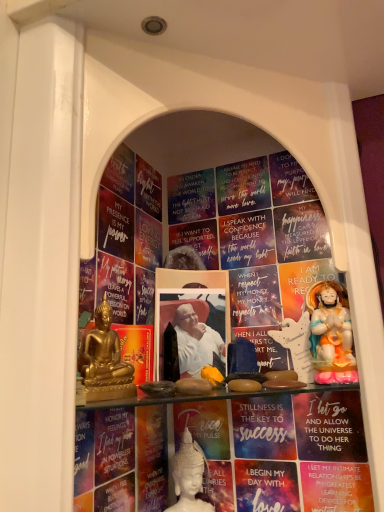
Question: Can you confirm if matte blue paperback book at center, the first paperback book in the right-to-left sequence, is wider than white porcelain statue at center, the 2th person from the left?

Choices:
 (A) no
 (B) yes

Answer: (A)

Question: From a real-world perspective, does matte blue paperback book at center, the first paperback book in the right-to-left sequence, sit lower than white porcelain statue at center, placed as the 2th person when sorted from right to left?

Choices:
 (A) yes
 (B) no

Answer: (B)

Question: Would you say matte blue paperback book at center, the 3th paperback book from the left, contains white porcelain statue at center, the 3th person from the top?

Choices:
 (A) yes
 (B) no

Answer: (B)

Question: From the image's perspective, is matte blue paperback book at center, the first paperback book in the right-to-left sequence, beneath white porcelain statue at center, the 3th person positioned from the front?

Choices:
 (A) yes
 (B) no

Answer: (B)

Question: From a real-world perspective, is matte blue paperback book at center, the 3th paperback book from the left, physically above white porcelain statue at center, the 3th person positioned from the front?

Choices:
 (A) yes
 (B) no

Answer: (A)

Question: Is matte blue paperback book at center, the 3th paperback book from the left, at the left side of white porcelain statue at center, the 2th person from the left?

Choices:
 (A) yes
 (B) no

Answer: (B)

Question: Considering the relative positions of matte blue paperback book at center, the first paperback book in the right-to-left sequence, and porcelain statue at right, the 2th person from the front, in the image provided, is matte blue paperback book at center, the first paperback book in the right-to-left sequence, to the right of porcelain statue at right, the 2th person from the front, from the viewer's perspective?

Choices:
 (A) no
 (B) yes

Answer: (A)

Question: Is matte blue paperback book at center, the first paperback book in the right-to-left sequence, not near porcelain statue at right, the first person in the top-to-bottom sequence?

Choices:
 (A) yes
 (B) no

Answer: (B)

Question: Is matte blue paperback book at center, the 3th paperback book from the left, behind porcelain statue at right, which appears as the 2th person when viewed from the back?

Choices:
 (A) yes
 (B) no

Answer: (A)

Question: Can you confirm if matte blue paperback book at center, the 3th paperback book from the left, is smaller than porcelain statue at right, the third person in the bottom-to-top sequence?

Choices:
 (A) yes
 (B) no

Answer: (A)

Question: Considering the relative sizes of matte blue paperback book at center, the 3th paperback book from the left, and porcelain statue at right, the third person in the bottom-to-top sequence, in the image provided, is matte blue paperback book at center, the 3th paperback book from the left, taller than porcelain statue at right, the third person in the bottom-to-top sequence,?

Choices:
 (A) yes
 (B) no

Answer: (B)

Question: Is matte blue paperback book at center, the 3th paperback book from the left, surrounding porcelain statue at right, which appears as the 2th person when viewed from the back?

Choices:
 (A) no
 (B) yes

Answer: (A)

Question: Can you confirm if matte gold statue at right is thinner than porcelain statue at right, the third person in the bottom-to-top sequence?

Choices:
 (A) yes
 (B) no

Answer: (A)